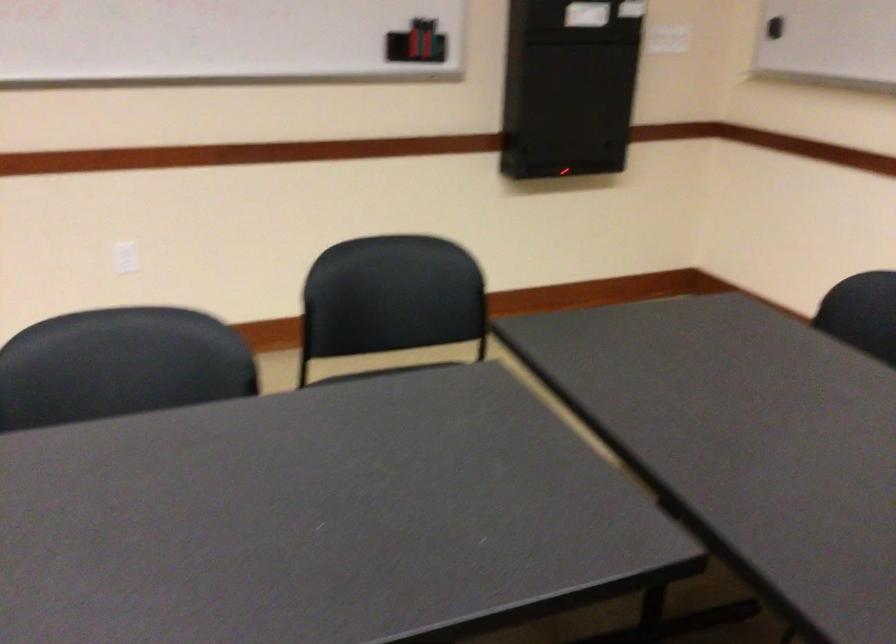
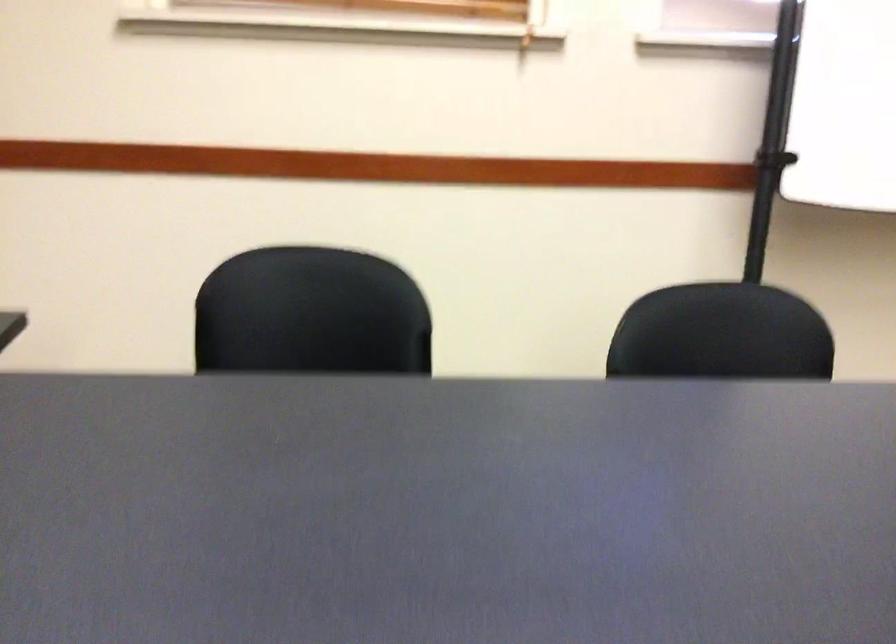
The images are taken continuously from a first-person perspective. In which direction is your viewpoint rotating?

The rotation direction of the camera is left-down.